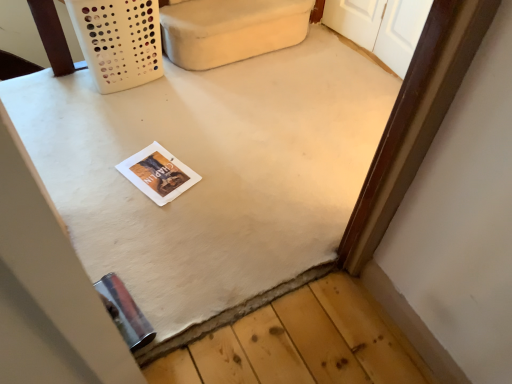
I want to click on vacant space that is in between white paper magazine at center and white fabric couch at upper center, so coord(209,100).